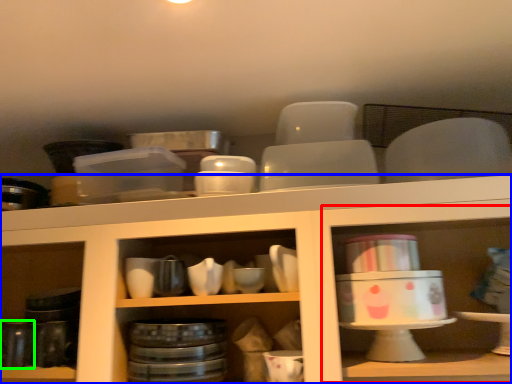
Question: Based on their relative distances, which object is farther from shelf (highlighted by a red box)? Choose from shelf (highlighted by a blue box) and tableware (highlighted by a green box).

Choices:
 (A) shelf
 (B) tableware

Answer: (B)